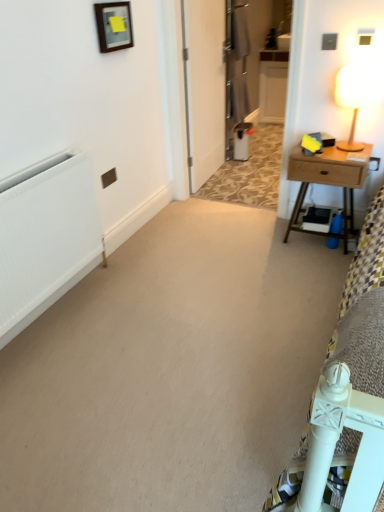
Question: Considering the relative sizes of wooden nightstand at right and white matte radiator at left in the image provided, is wooden nightstand at right thinner than white matte radiator at left?

Choices:
 (A) yes
 (B) no

Answer: (B)

Question: Can you confirm if wooden nightstand at right is positioned to the right of white matte radiator at left?

Choices:
 (A) yes
 (B) no

Answer: (A)

Question: From a real-world perspective, is wooden nightstand at right on white matte radiator at left?

Choices:
 (A) no
 (B) yes

Answer: (A)

Question: Is wooden nightstand at right closer to camera compared to white matte radiator at left?

Choices:
 (A) yes
 (B) no

Answer: (B)

Question: Is wooden nightstand at right at the left side of white matte radiator at left?

Choices:
 (A) yes
 (B) no

Answer: (B)

Question: Could you tell me if wooden nightstand at right is facing white matte radiator at left?

Choices:
 (A) no
 (B) yes

Answer: (A)

Question: Is white matte radiator at left aimed at wooden frame at upper center?

Choices:
 (A) no
 (B) yes

Answer: (A)

Question: Considering the relative positions of white matte radiator at left and wooden frame at upper center in the image provided, is white matte radiator at left in front of wooden frame at upper center?

Choices:
 (A) yes
 (B) no

Answer: (A)

Question: From a real-world perspective, is white matte radiator at left located higher than wooden frame at upper center?

Choices:
 (A) yes
 (B) no

Answer: (B)

Question: From the image's perspective, is white matte radiator at left beneath wooden frame at upper center?

Choices:
 (A) yes
 (B) no

Answer: (A)

Question: Is white matte radiator at left positioned behind wooden frame at upper center?

Choices:
 (A) no
 (B) yes

Answer: (A)

Question: Is white matte radiator at left oriented away from wooden frame at upper center?

Choices:
 (A) yes
 (B) no

Answer: (B)

Question: Is wooden nightstand at right taller than wooden frame at upper center?

Choices:
 (A) yes
 (B) no

Answer: (A)